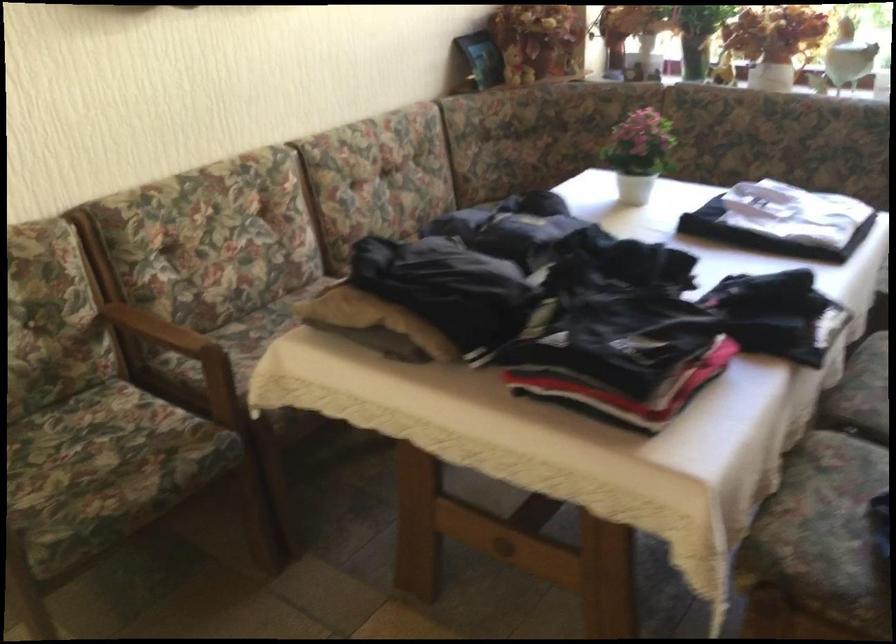
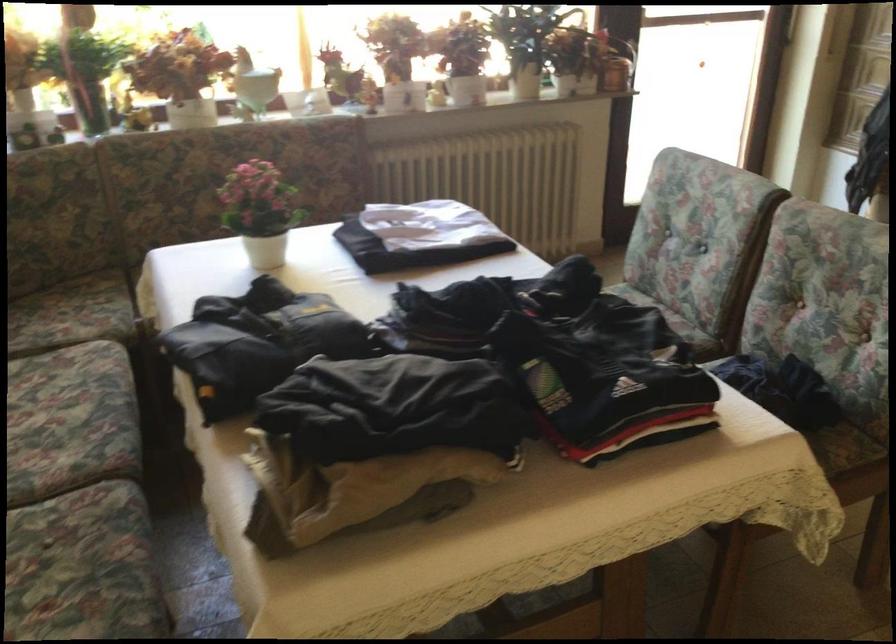
Find the pixel in the second image that matches (x=622, y=149) in the first image.

(261, 212)